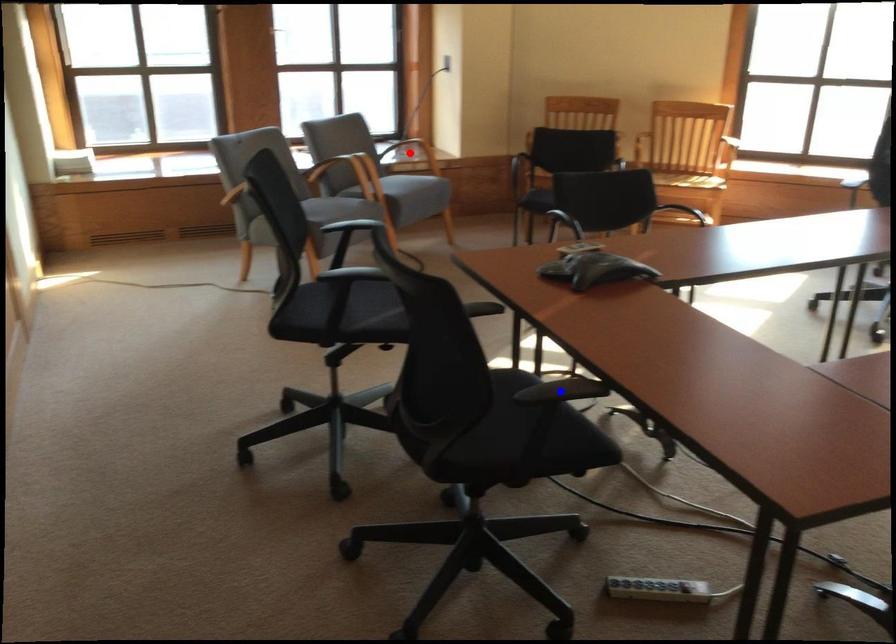
Question: In the image, two points are highlighted. Which point is nearer to the camera? Reply with the corresponding letter.

Choices:
 (A) blue point
 (B) red point

Answer: (A)